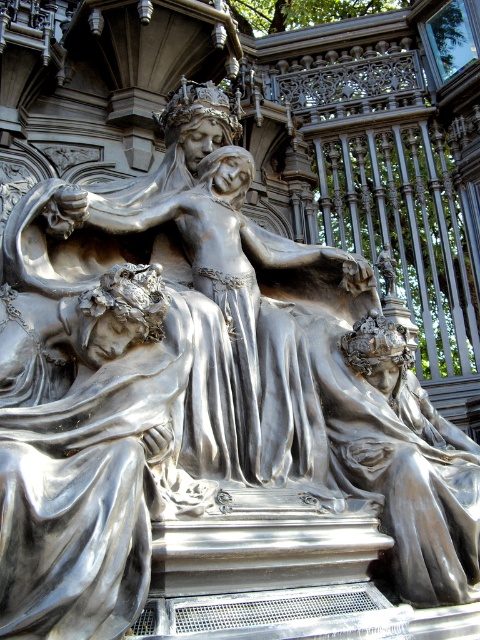
You are an art curator examining the bronze sculpture. You notice the shiny silver figure at lower left and the shiny silver statue at center. Which one is taller?

The shiny silver statue at center is taller than the shiny silver figure at lower left.

You are an art curator examining the bronze sculpture. You notice the shiny silver figure at lower left and the shiny silver statue at center. Which one takes up more space in the sculpture?

The shiny silver statue at center takes up more space than the shiny silver figure at lower left because the shiny silver figure at lower left occupies less space than shiny silver statue at center.

You are an art conservator examining the bronze sculpture. You notice a shiny silver area at point (87, 467). Based on the description, which object in the scene does this point correspond to?

The point (87, 467) corresponds to the shiny silver figure at lower left.